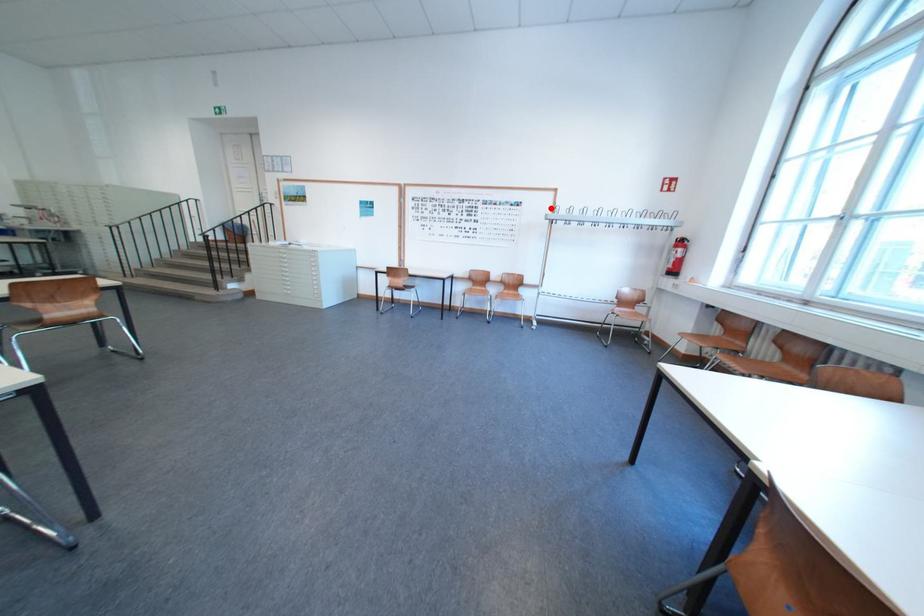
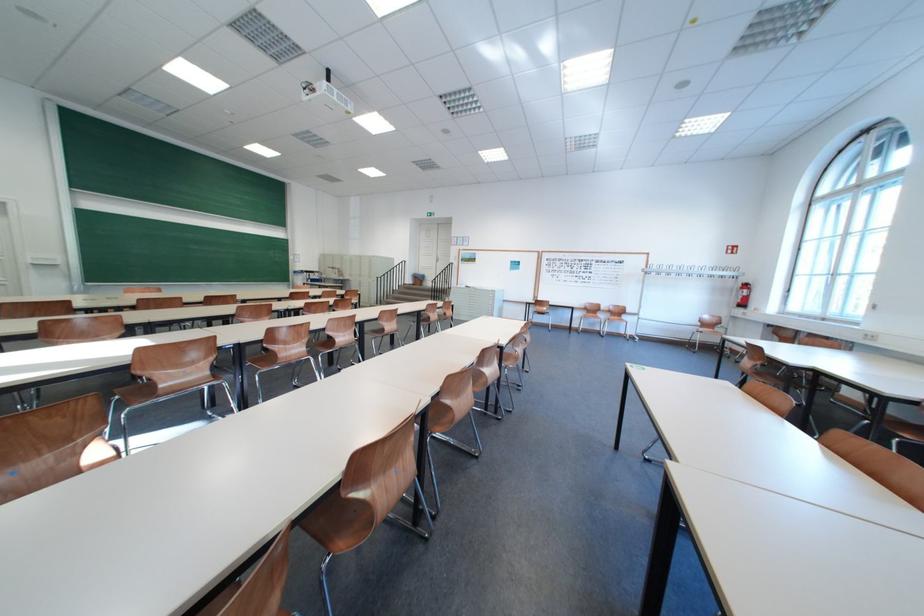
Question: A red point is marked in image1. In image2, is the corresponding 3D point closer to the camera or farther? Reply with the corresponding letter.

Choices:
 (A) The corresponding 3D point is closer.
 (B) The corresponding 3D point is farther.

Answer: (B)